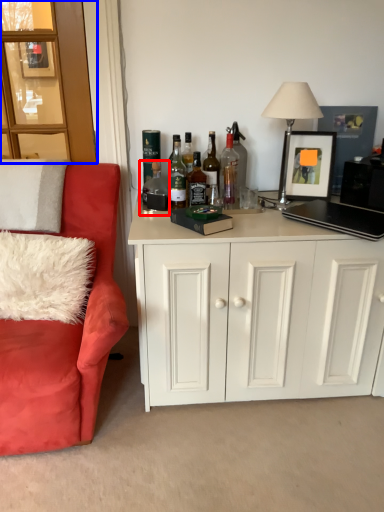
Question: Which point is closer to the camera, bottle (highlighted by a red box) or glass door (highlighted by a blue box)?

Choices:
 (A) bottle
 (B) glass door

Answer: (B)